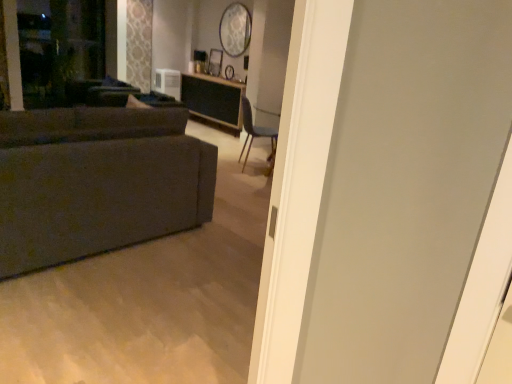
At what (x,y) coordinates should I click in order to perform the action: click on textured gray couch at left. Please return your answer as a coordinate pair (x, y). Looking at the image, I should click on [97, 182].

The width and height of the screenshot is (512, 384). I want to click on white plastic air conditioner at upper center, so click(x=168, y=82).

Could you tell me if textured gray couch at left is turned towards white plastic air conditioner at upper center?

No, textured gray couch at left is not turned towards white plastic air conditioner at upper center.

Which is more to the right, textured gray couch at left or white plastic air conditioner at upper center?

textured gray couch at left is more to the right.

Are wooden table at center and transparent glass screen door at upper left beside each other?

No, wooden table at center is not making contact with transparent glass screen door at upper left.

Does wooden table at center appear on the right side of transparent glass screen door at upper left?

Indeed, wooden table at center is positioned on the right side of transparent glass screen door at upper left.

Considering the points (237, 113) and (57, 90), which point is in front, point (237, 113) or point (57, 90)?

The point (57, 90) is in front.

At what (x,y) coordinates should I click in order to perform the action: click on table behind the transparent glass screen door at upper left. Please return your answer as a coordinate pair (x, y). Image resolution: width=512 pixels, height=384 pixels. Looking at the image, I should click on (213, 100).

In terms of height, does white plastic air conditioner at upper center look taller or shorter compared to blue fabric chair at center?

white plastic air conditioner at upper center is shorter than blue fabric chair at center.

From the image's perspective, is white plastic air conditioner at upper center located above or below blue fabric chair at center?

Based on their image positions, white plastic air conditioner at upper center is located above blue fabric chair at center.

Is white plastic air conditioner at upper center surrounding blue fabric chair at center?

That's incorrect, blue fabric chair at center is not inside white plastic air conditioner at upper center.

Is blue fabric chair at center at the back of white plastic air conditioner at upper center?

white plastic air conditioner at upper center does not have its back to blue fabric chair at center.

Can you confirm if wooden table at center is positioned to the right of white plastic air conditioner at upper center?

Correct, you'll find wooden table at center to the right of white plastic air conditioner at upper center.

Looking at their sizes, would you say wooden table at center is wider or thinner than white plastic air conditioner at upper center?

wooden table at center is wider than white plastic air conditioner at upper center.

What's the angular difference between wooden table at center and white plastic air conditioner at upper center's facing directions?

The angle between the facing direction of wooden table at center and the facing direction of white plastic air conditioner at upper center is 86.3 degrees.

Who is shorter, wooden table at center or white plastic air conditioner at upper center?

white plastic air conditioner at upper center.

Does white plastic air conditioner at upper center have a larger size compared to textured gray couch at left?

No.

This screenshot has height=384, width=512. I want to click on appliance that is above the textured gray couch at left (from the image's perspective), so click(x=168, y=82).

Are white plastic air conditioner at upper center and textured gray couch at left making contact?

No.

Is blue fabric chair at center to the right of textured gray couch at left from the viewer's perspective?

Indeed, blue fabric chair at center is positioned on the right side of textured gray couch at left.

Would you say blue fabric chair at center is outside textured gray couch at left?

blue fabric chair at center lies outside textured gray couch at left's area.

Are blue fabric chair at center and textured gray couch at left far apart?

Absolutely, blue fabric chair at center is distant from textured gray couch at left.

From a real-world perspective, is blue fabric chair at center located higher than textured gray couch at left?

Actually, blue fabric chair at center is physically below textured gray couch at left in the real world.

Considering the sizes of objects blue fabric chair at center and wooden table at center in the image provided, who is taller, blue fabric chair at center or wooden table at center?

blue fabric chair at center is taller.

Considering the relative sizes of blue fabric chair at center and wooden table at center in the image provided, is blue fabric chair at center smaller than wooden table at center?

Yes, blue fabric chair at center is smaller than wooden table at center.

Is blue fabric chair at center in front of wooden table at center?

Yes, the depth of blue fabric chair at center is less than that of wooden table at center.

From a real-world perspective, which is physically above, blue fabric chair at center or wooden table at center?

blue fabric chair at center is physically above.

Locate an element on the screen. studio couch located underneath the white plastic air conditioner at upper center (from a real-world perspective) is located at coordinates (97, 182).

Image resolution: width=512 pixels, height=384 pixels. I want to click on screen door located in front of the wooden table at center, so click(57, 48).

Considering their positions, is transparent glass screen door at upper left positioned closer to blue fabric chair at center than wooden table at center?

wooden table at center lies closer to blue fabric chair at center than the other object.

Estimate the real-world distances between objects in this image. Which object is further from blue fabric chair at center, wooden table at center or white plastic air conditioner at upper center?

The object further to blue fabric chair at center is white plastic air conditioner at upper center.

Which object lies further to the anchor point wooden table at center, transparent glass screen door at upper left or blue fabric chair at center?

The object further to wooden table at center is transparent glass screen door at upper left.

Which object lies further to the anchor point wooden table at center, transparent glass screen door at upper left or white plastic air conditioner at upper center?

Based on the image, transparent glass screen door at upper left appears to be further to wooden table at center.

Which object lies further to the anchor point white plastic air conditioner at upper center, transparent glass screen door at upper left or textured gray couch at left?

textured gray couch at left is positioned further to the anchor white plastic air conditioner at upper center.

Based on their spatial positions, is textured gray couch at left or white plastic air conditioner at upper center closer to transparent glass screen door at upper left?

white plastic air conditioner at upper center.

Which object lies nearer to the anchor point transparent glass screen door at upper left, blue fabric chair at center or wooden table at center?

Among the two, wooden table at center is located nearer to transparent glass screen door at upper left.

Which object lies further to the anchor point blue fabric chair at center, transparent glass screen door at upper left or white plastic air conditioner at upper center?

transparent glass screen door at upper left.

Where is `appliance between transparent glass screen door at upper left and wooden table at center from left to right`? This screenshot has width=512, height=384. appliance between transparent glass screen door at upper left and wooden table at center from left to right is located at coordinates (168, 82).

The height and width of the screenshot is (384, 512). I want to click on screen door between textured gray couch at left and white plastic air conditioner at upper center from front to back, so click(57, 48).

Locate an element on the screen. The width and height of the screenshot is (512, 384). chair between textured gray couch at left and white plastic air conditioner at upper center from front to back is located at coordinates (256, 135).

This screenshot has width=512, height=384. In order to click on table located between transparent glass screen door at upper left and blue fabric chair at center in the left-right direction in this screenshot , I will do `click(213, 100)`.